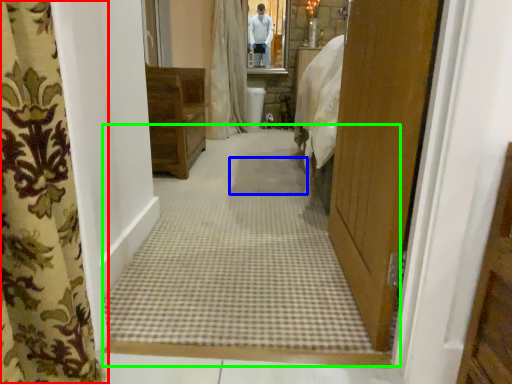
Question: Estimate the real-world distances between objects in this image. Which object is farther from curtain (highlighted by a red box), mat (highlighted by a blue box) or plain (highlighted by a green box)?

Choices:
 (A) mat
 (B) plain

Answer: (A)